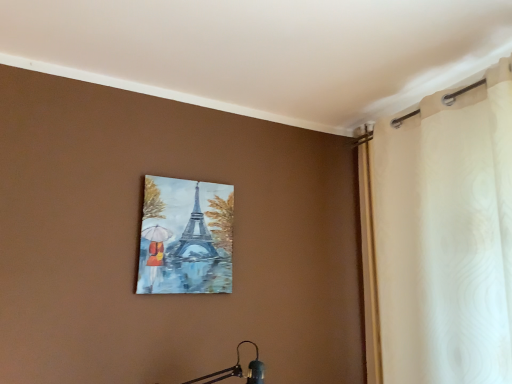
Question: Which is correct: white sheer curtain at upper right is inside matte canvas painting of eiffel tower at upper center, or outside of it?

Choices:
 (A) outside
 (B) inside

Answer: (A)

Question: Based on their sizes in the image, would you say white sheer curtain at upper right is bigger or smaller than matte canvas painting of eiffel tower at upper center?

Choices:
 (A) small
 (B) big

Answer: (B)

Question: From the image's perspective, relative to matte canvas painting of eiffel tower at upper center, is white sheer curtain at upper right above or below?

Choices:
 (A) below
 (B) above

Answer: (B)

Question: Is point click(217, 244) positioned closer to the camera than point click(499, 281)?

Choices:
 (A) farther
 (B) closer

Answer: (A)

Question: Visually, is matte canvas painting of eiffel tower at upper center positioned to the left or to the right of white sheer curtain at upper right?

Choices:
 (A) left
 (B) right

Answer: (A)

Question: From their relative heights in the image, would you say matte canvas painting of eiffel tower at upper center is taller or shorter than white sheer curtain at upper right?

Choices:
 (A) tall
 (B) short

Answer: (B)

Question: In terms of size, does matte canvas painting of eiffel tower at upper center appear bigger or smaller than white sheer curtain at upper right?

Choices:
 (A) big
 (B) small

Answer: (B)